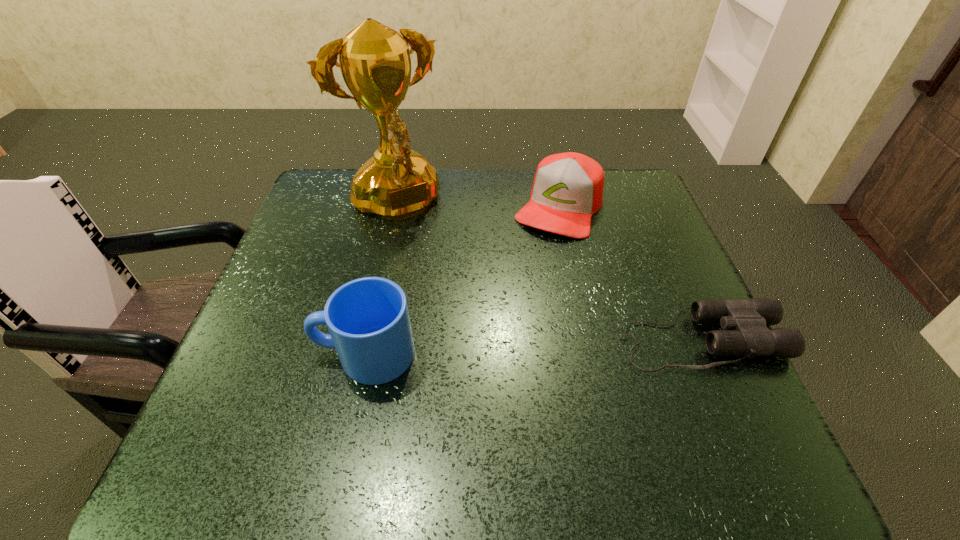
Find the location of a particular element. The height and width of the screenshot is (540, 960). object that is at the near left corner is located at coordinates (368, 320).

Where is `object present at the far right corner`? object present at the far right corner is located at coordinates (567, 190).

The image size is (960, 540). Find the location of `vacant space at the far edge of the desktop`. vacant space at the far edge of the desktop is located at coordinates pyautogui.click(x=438, y=197).

Image resolution: width=960 pixels, height=540 pixels. I want to click on blank space at the near edge of the desktop, so click(525, 379).

Image resolution: width=960 pixels, height=540 pixels. In the image, there is a desktop. What are the coordinates of `free space at the left edge` in the screenshot? It's located at (278, 373).

The width and height of the screenshot is (960, 540). Identify the location of free space at the right edge of the desktop. (660, 314).

Find the location of a particular element. blank space at the far left corner of the desktop is located at coordinates (324, 202).

In the image, there is a desktop. Where is `vacant space at the near right corner`? The height and width of the screenshot is (540, 960). vacant space at the near right corner is located at coordinates (723, 376).

Image resolution: width=960 pixels, height=540 pixels. I want to click on vacant area between the mug and the baseball cap, so click(462, 280).

At what (x,y) coordinates should I click in order to perform the action: click on free space between the shortest object and the baseball cap. Please return your answer as a coordinate pair (x, y). Image resolution: width=960 pixels, height=540 pixels. Looking at the image, I should click on (630, 273).